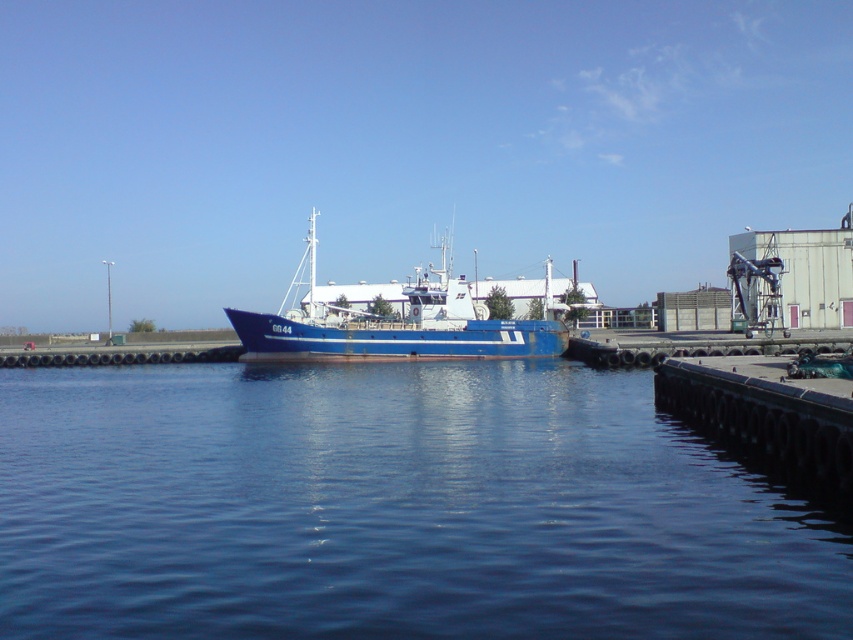
Question: Which point is farther to the camera?

Choices:
 (A) blue matte boat at center
 (B) blue water at center

Answer: (A)

Question: Does blue water at center have a smaller size compared to blue matte boat at center?

Choices:
 (A) no
 (B) yes

Answer: (B)

Question: Does blue water at center have a larger size compared to blue matte boat at center?

Choices:
 (A) yes
 (B) no

Answer: (B)

Question: Can you confirm if blue water at center is bigger than blue matte boat at center?

Choices:
 (A) no
 (B) yes

Answer: (A)

Question: Which point appears farthest from the camera in this image?

Choices:
 (A) (427, 332)
 (B) (616, 504)

Answer: (A)